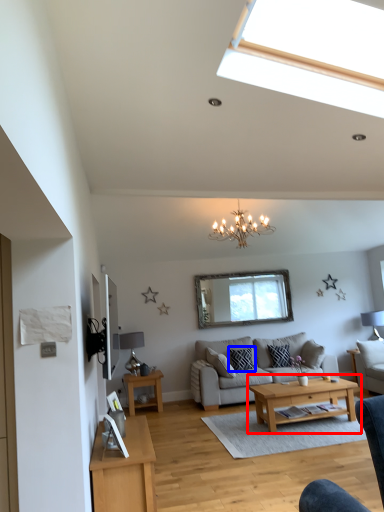
Question: Which point is further to the camera, coffee table (highlighted by a red box) or pillow (highlighted by a blue box)?

Choices:
 (A) coffee table
 (B) pillow

Answer: (B)